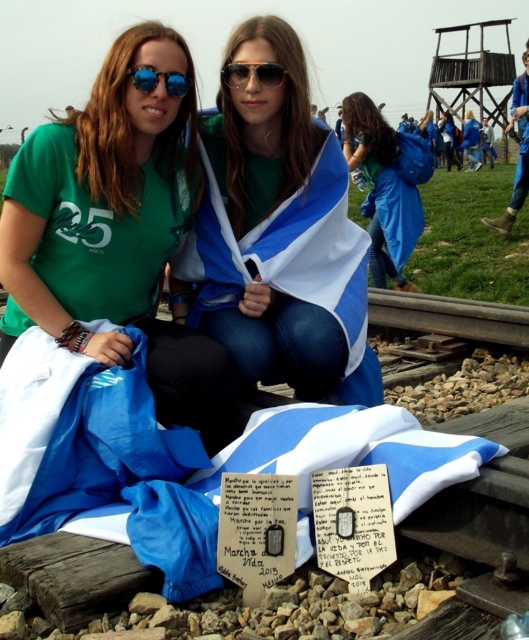
Question: Estimate the real-world distances between objects in this image. Which object is farther from the blue fabric at center?

Choices:
 (A) green matte t-shirt at left
 (B) white paper plaque at center

Answer: (B)

Question: Which point appears closest to the camera in this image?

Choices:
 (A) (405, 257)
 (B) (305, 193)

Answer: (B)

Question: Is blue fabric flag at center wider than white paper plaque at center?

Choices:
 (A) no
 (B) yes

Answer: (B)

Question: Is green matte t-shirt at left to the left of blue reflective sunglasses at upper center from the viewer's perspective?

Choices:
 (A) no
 (B) yes

Answer: (B)

Question: Which of the following is the farthest from the observer?

Choices:
 (A) (239, 168)
 (B) (35, 294)

Answer: (A)

Question: Observing the image, what is the correct spatial positioning of blue fabric at center in reference to shiny black sunglasses at center?

Choices:
 (A) above
 (B) below

Answer: (A)